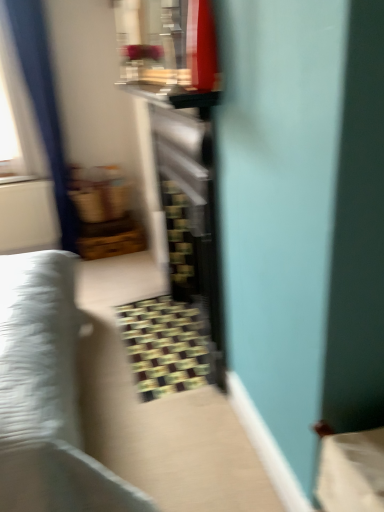
What do you see at coordinates (165, 345) in the screenshot? The width and height of the screenshot is (384, 512). I see `woven fabric carpet at center` at bounding box center [165, 345].

Locate an element on the screen. This screenshot has width=384, height=512. woven fabric carpet at center is located at coordinates click(x=165, y=345).

What is the approximate height of woven fabric carpet at center?

woven fabric carpet at center is 4.25 centimeters tall.

The height and width of the screenshot is (512, 384). In order to click on woven fabric carpet at center in this screenshot , I will do `click(165, 345)`.